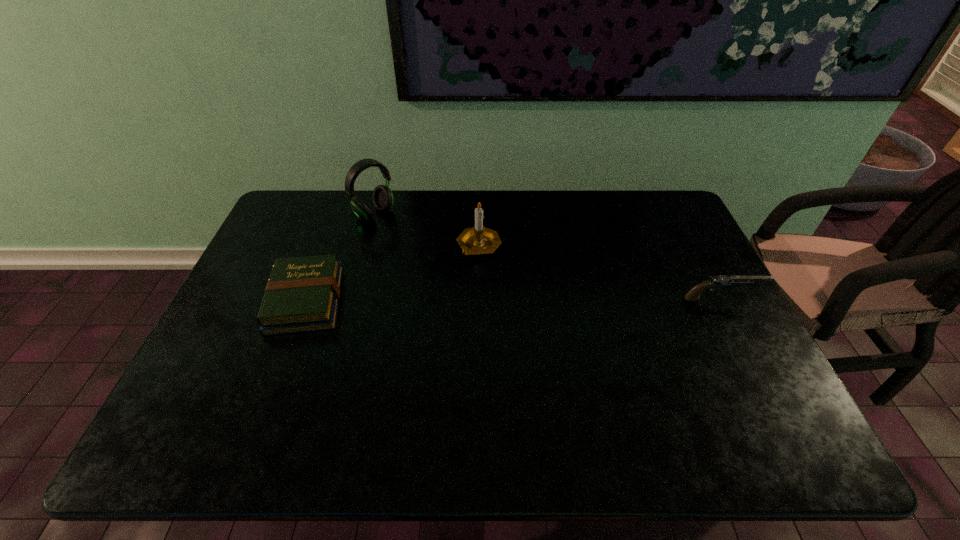
Where is `vacant space at the left edge`? This screenshot has height=540, width=960. vacant space at the left edge is located at coordinates (258, 256).

Find the location of a particular element. vacant space at the right edge of the desktop is located at coordinates (668, 249).

Where is `vacant space at the far left corner of the desktop`? vacant space at the far left corner of the desktop is located at coordinates (313, 192).

Locate an element on the screen. vacant space at the far right corner of the desktop is located at coordinates (657, 192).

This screenshot has width=960, height=540. What are the coordinates of `free space between the second shortest object and the book` in the screenshot? It's located at (514, 299).

Image resolution: width=960 pixels, height=540 pixels. In order to click on free space between the farthest object and the second object from right to left in this screenshot , I will do `click(426, 230)`.

This screenshot has height=540, width=960. I want to click on vacant space in between the gun and the candle holder, so point(600,272).

Find the location of a particular element. This screenshot has height=540, width=960. vacant region between the gun and the third object from left to right is located at coordinates (600, 272).

Where is `free area in between the shortest object and the farthest object`? This screenshot has height=540, width=960. free area in between the shortest object and the farthest object is located at coordinates (340, 257).

What are the coordinates of `free point between the shortest object and the third tallest object` in the screenshot? It's located at (514, 299).